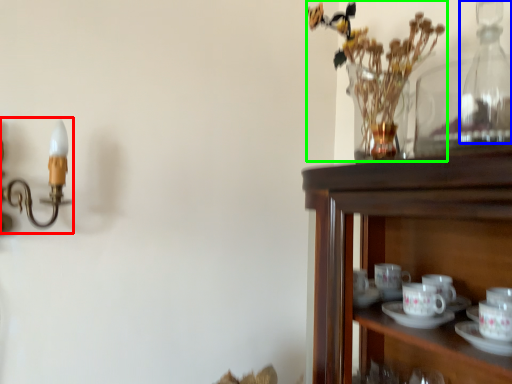
Question: Considering the real-world distances, which object is farthest from candle holder (highlighted by a red box)? bottle (highlighted by a blue box) or floral arrangement (highlighted by a green box)?

Choices:
 (A) bottle
 (B) floral arrangement

Answer: (A)